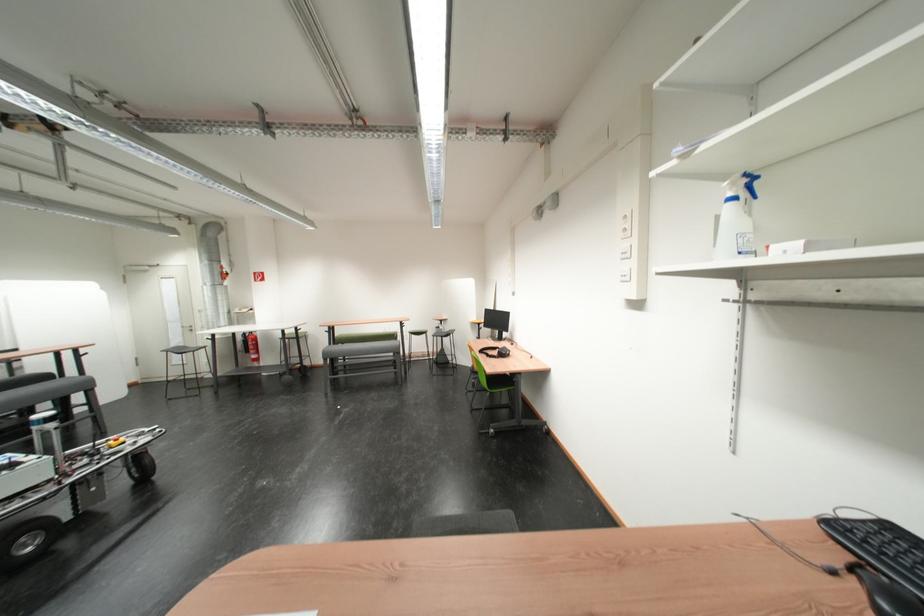
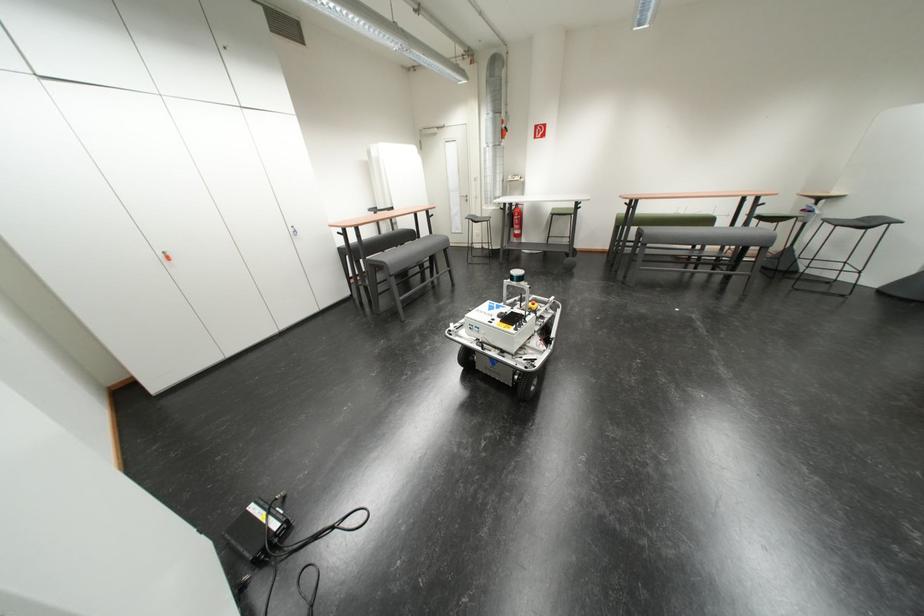
Find the pixel in the second image that matches the point at 219,341 in the first image.

(512, 211)